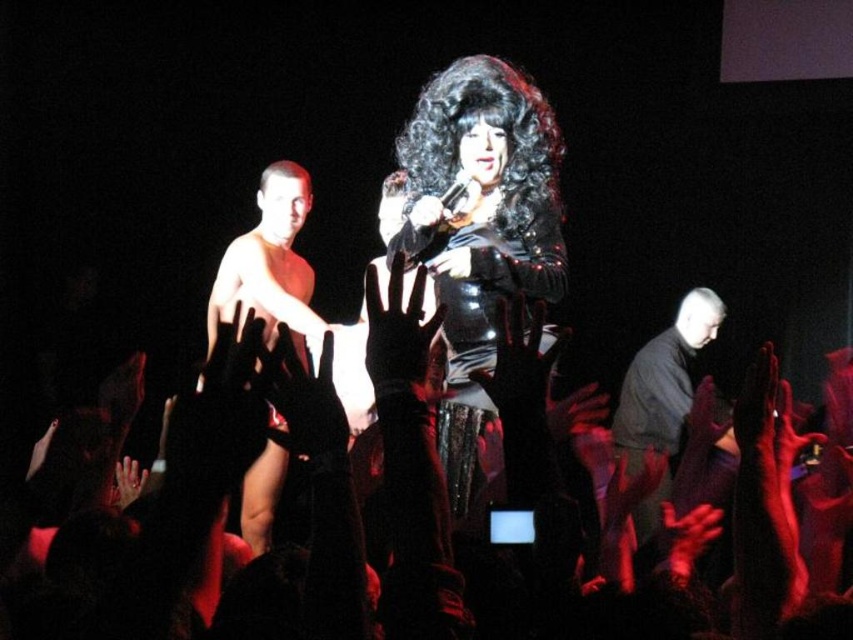
Who is shorter, shiny skin torso at center or black matte shirt at lower right?

shiny skin torso at center is shorter.

Is point (265, 289) positioned after point (676, 384)?

No.

Image resolution: width=853 pixels, height=640 pixels. Find the location of `shiny skin torso at center`. shiny skin torso at center is located at coordinates (270, 260).

Who is lower down, shiny black dress at center or shiny skin torso at center?

shiny black dress at center

Which is in front, point (456, 349) or point (286, 262)?

Positioned in front is point (456, 349).

What do you see at coordinates (480, 205) in the screenshot? I see `shiny black dress at center` at bounding box center [480, 205].

Locate an element on the screen. Image resolution: width=853 pixels, height=640 pixels. shiny black dress at center is located at coordinates point(480,205).

Can you confirm if shiny black dress at center is shorter than black matte shirt at lower right?

Incorrect, shiny black dress at center's height does not fall short of black matte shirt at lower right's.

Does shiny black dress at center appear on the left side of black matte shirt at lower right?

Indeed, shiny black dress at center is positioned on the left side of black matte shirt at lower right.

The height and width of the screenshot is (640, 853). Describe the element at coordinates (480, 205) in the screenshot. I see `shiny black dress at center` at that location.

The width and height of the screenshot is (853, 640). Find the location of `shiny black dress at center`. shiny black dress at center is located at coordinates (480, 205).